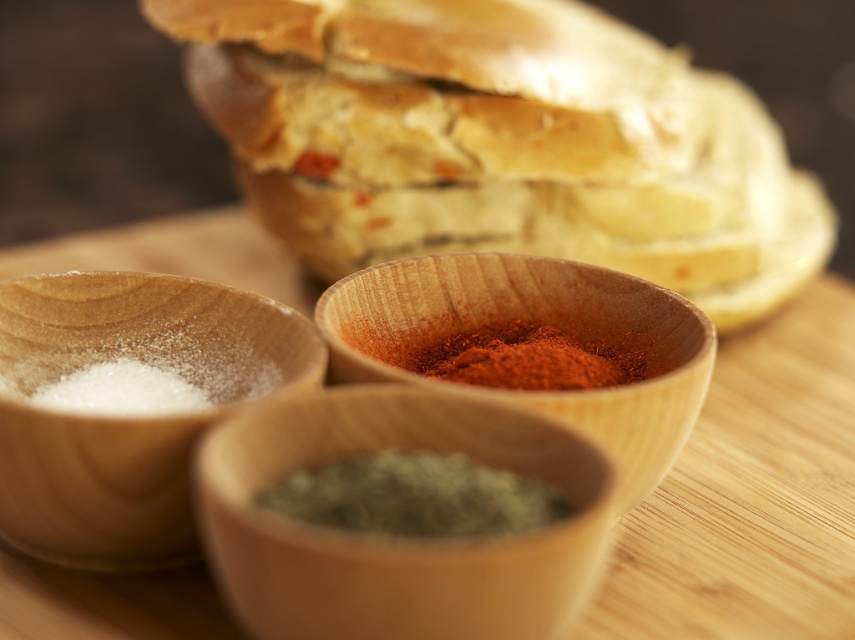
Between white powder at left and green herb at center, which one appears on the left side from the viewer's perspective?

From the viewer's perspective, white powder at left appears more on the left side.

Does point (74, 476) lie in front of point (366, 483)?

No, it is not.

Where is `white powder at left`? The height and width of the screenshot is (640, 855). white powder at left is located at coordinates (127, 417).

Can you confirm if wooden spice at center is shorter than red powder spice at center?

No.

Is point (612, 340) farther from camera compared to point (414, 352)?

That is False.

Which is behind, point (617, 332) or point (447, 362)?

Positioned behind is point (617, 332).

I want to click on wooden spice at center, so click(547, 326).

The width and height of the screenshot is (855, 640). What do you see at coordinates (547, 326) in the screenshot?
I see `wooden spice at center` at bounding box center [547, 326].

Is point (565, 298) positioned after point (388, 532)?

Yes.

Find the location of a particular element. wooden spice at center is located at coordinates (547, 326).